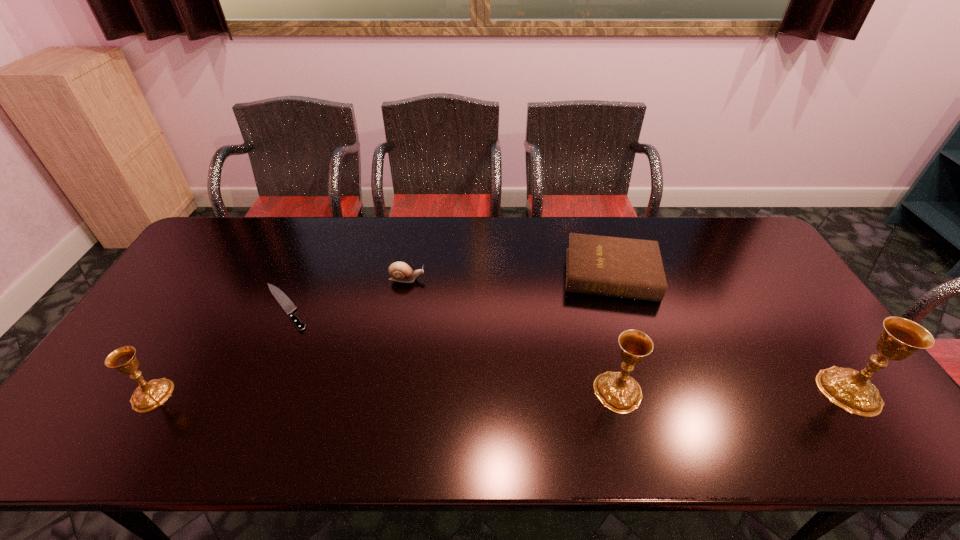
I want to click on free spot that satisfies the following two spatial constraints: 1. on the front-facing side of the tallest object; 2. on the right side of the fourth object from right to left, so click(387, 390).

Identify the location of vacant position in the image that satisfies the following two spatial constraints: 1. on the front-facing side of the tallest chalice; 2. on the right side of the escargot. The width and height of the screenshot is (960, 540). (387, 390).

Where is `free space that satisfies the following two spatial constraints: 1. on the back side of the shortest chalice; 2. on the right side of the second shortest chalice`? free space that satisfies the following two spatial constraints: 1. on the back side of the shortest chalice; 2. on the right side of the second shortest chalice is located at coordinates (154, 392).